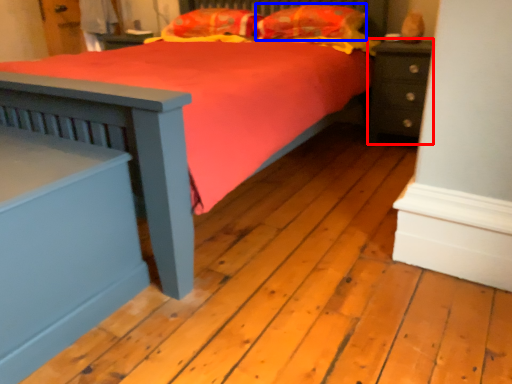
Question: Which object appears closest to the camera in this image, nightstand (highlighted by a red box) or pillow (highlighted by a blue box)?

Choices:
 (A) nightstand
 (B) pillow

Answer: (A)